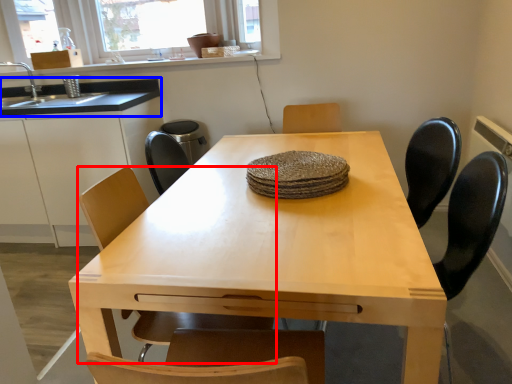
Question: Which point is further to the camera, chair (highlighted by a red box) or countertop (highlighted by a blue box)?

Choices:
 (A) chair
 (B) countertop

Answer: (B)